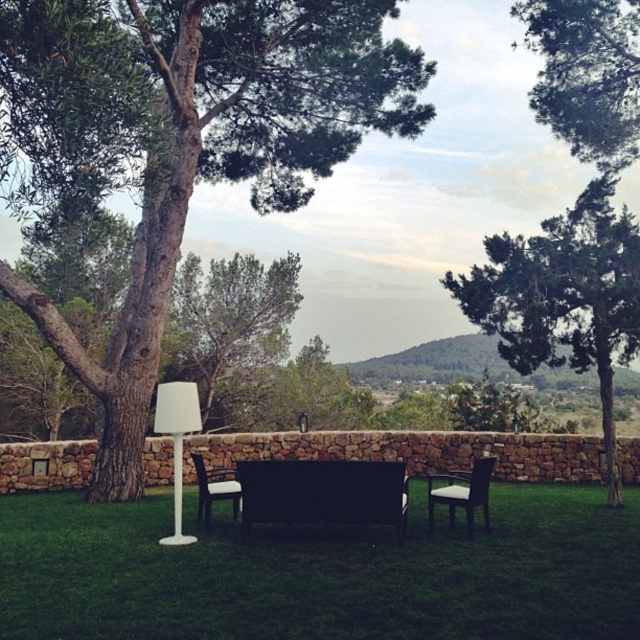
Does point (589, 358) come closer to viewer compared to point (545, 120)?

That is True.

Measure the distance between green leafy tree at right and green leafy tree at upper right.

green leafy tree at right and green leafy tree at upper right are 4.78 meters apart from each other.

Is point (605, 301) closer to camera compared to point (625, 109)?

Yes, point (605, 301) is in front of point (625, 109).

The height and width of the screenshot is (640, 640). Find the location of `green leafy tree at right`. green leafy tree at right is located at coordinates (563, 298).

Is point (173, 419) closer to camera compared to point (460, 490)?

Yes, point (173, 419) is in front of point (460, 490).

Between white matte lamp at center and black leather chair at right, which one has more height?

Standing taller between the two is white matte lamp at center.

Which is behind, point (180, 429) or point (428, 493)?

Positioned behind is point (428, 493).

In order to click on white matte lamp at center in this screenshot , I will do `click(177, 440)`.

Is the position of green leafy tree at center less distant than that of green leafy tree at right?

Yes, green leafy tree at center is in front of green leafy tree at right.

Between green leafy tree at center and green leafy tree at right, which one is positioned higher?

green leafy tree at center is above.

The height and width of the screenshot is (640, 640). I want to click on green leafy tree at center, so click(x=182, y=141).